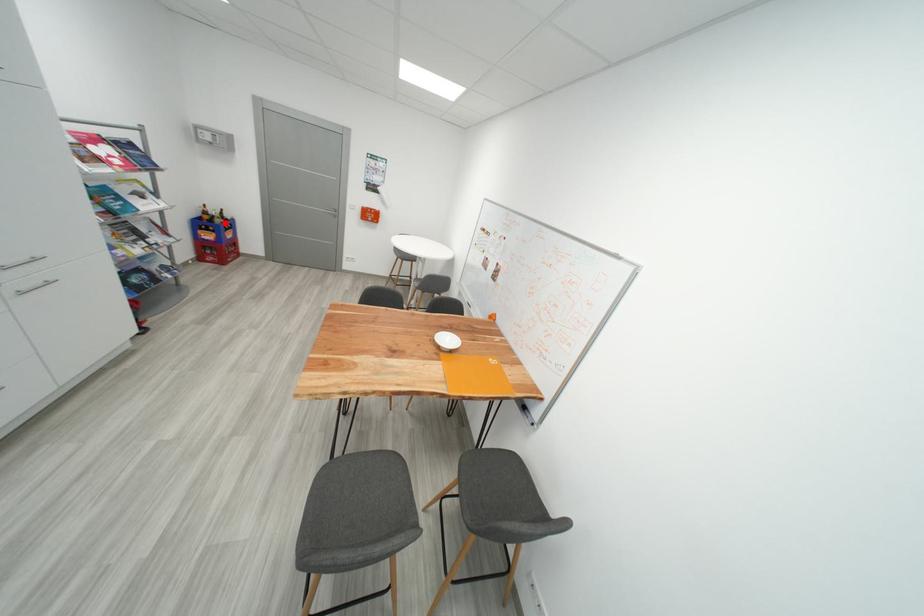
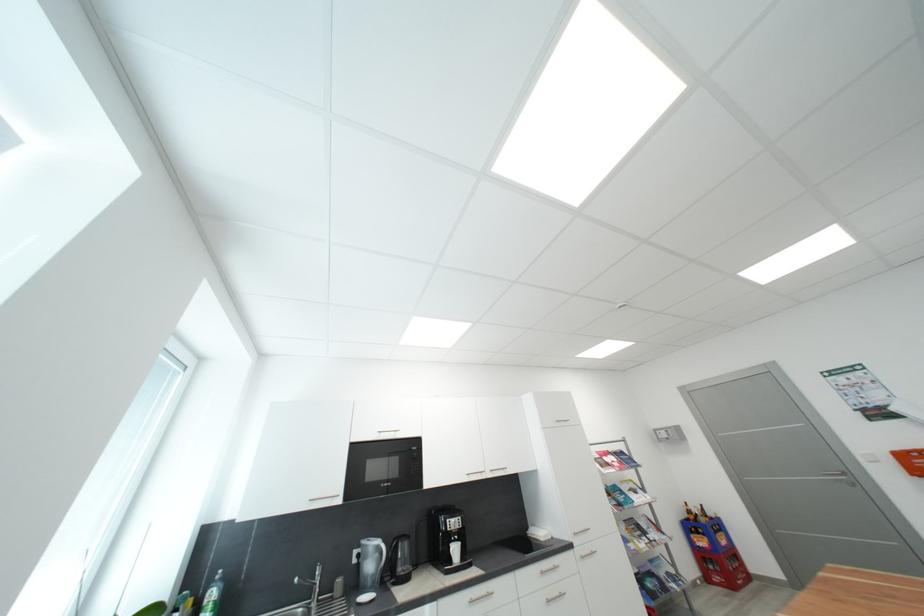
Question: I am providing you with two images of the same scene from different viewpoints. Given a red point in image1, look at the same physical point in image2. Is it:

Choices:
 (A) Closer to the viewpoint
 (B) Farther from the viewpoint

Answer: (B)